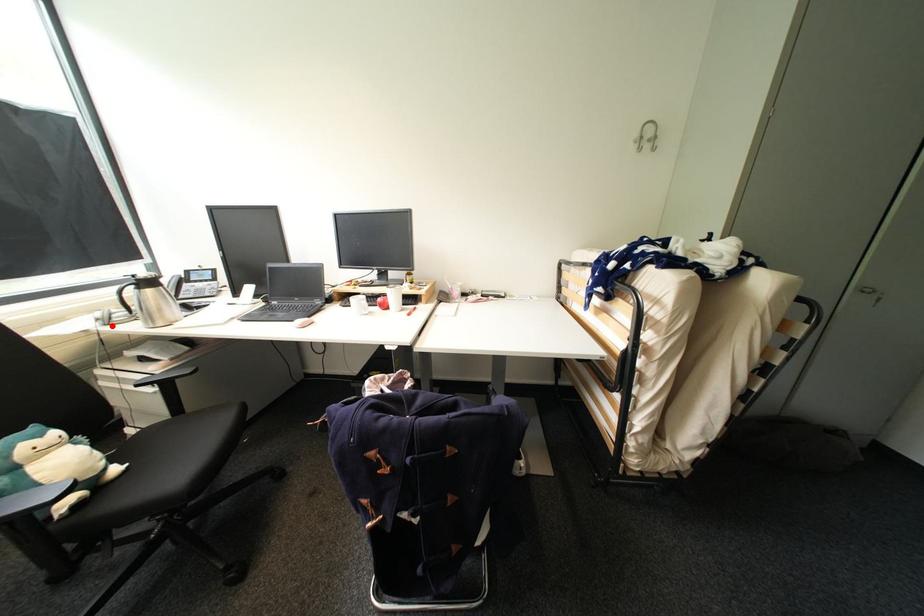
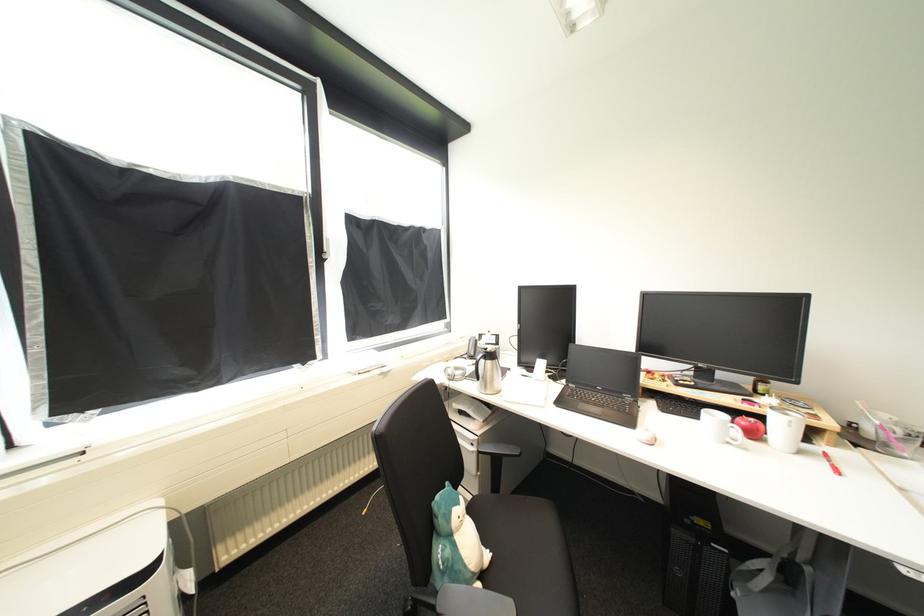
In the second image, find the point that corresponds to the highlighted location in the first image.

(456, 381)